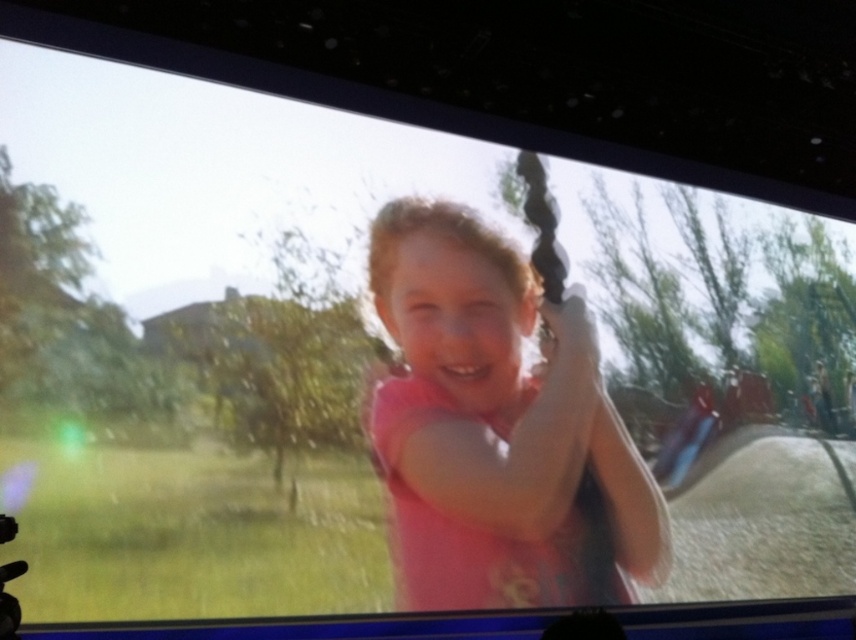
Based on the photo, you are a photographer trying to capture a candid shot of the girl in the park. You have two items in your viewfinder, the pink matte shirt at center and the matte plastic bag at lower right. Which object should you focus on to ensure the subject is in focus, considering their sizes in the frame?

The pink matte shirt at center is much taller than the matte plastic bag at lower right, so focusing on the pink matte shirt at center would ensure the subject is in focus as it is larger in the frame.